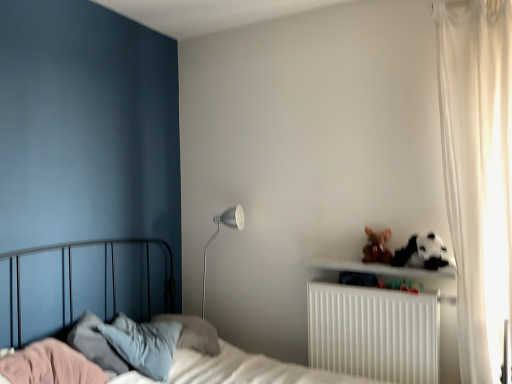
What do you see at coordinates (374, 332) in the screenshot? The width and height of the screenshot is (512, 384). I see `white plastic radiator at lower right` at bounding box center [374, 332].

Measure the distance between point (205, 268) and camera.

Point (205, 268) and camera are 10.15 feet apart.

In order to face white sheer curtain at right, should I rotate leftwards or rightwards?

You should rotate right by 27.325 degrees.

Measure the distance between point (x=379, y=239) and camera.

Point (x=379, y=239) is 7.87 feet away from camera.

Image resolution: width=512 pixels, height=384 pixels. Find the location of `white plastic radiator at lower right`. white plastic radiator at lower right is located at coordinates (374, 332).

Is white sheer curtain at right at the back of metallic bed at left?

metallic bed at left does not have its back to white sheer curtain at right.

Is metallic bed at left bigger than white sheer curtain at right?

Correct, metallic bed at left is larger in size than white sheer curtain at right.

Is metallic bed at left spatially inside white sheer curtain at right, or outside of it?

metallic bed at left is spatially situated outside white sheer curtain at right.

Considering the positions of objects metallic bed at left and white sheer curtain at right in the image provided, who is in front, metallic bed at left or white sheer curtain at right?

metallic bed at left is closer to the camera.

Consider the image. From a real-world perspective, which object stands above the other?

silver metallic floor lamp at center-left, from a real-world perspective.

Who is shorter, silver metallic floor lamp at center-left or metallic bed at left?

Standing shorter between the two is silver metallic floor lamp at center-left.

From the image's perspective, does silver metallic floor lamp at center-left appear lower than metallic bed at left?

No, from the image's perspective, silver metallic floor lamp at center-left is not beneath metallic bed at left.

Considering the points (229, 225) and (200, 349), which point is behind, point (229, 225) or point (200, 349)?

The point (229, 225) is farther from the camera.

Between white sheer curtain at right and silver metallic floor lamp at center-left, which one is positioned behind?

silver metallic floor lamp at center-left is further from the camera.

Does white sheer curtain at right turn towards silver metallic floor lamp at center-left?

No, white sheer curtain at right is not oriented towards silver metallic floor lamp at center-left.

Considering the relative positions of white sheer curtain at right and silver metallic floor lamp at center-left in the image provided, is white sheer curtain at right to the left of silver metallic floor lamp at center-left from the viewer's perspective?

No.

From a real-world perspective, does white sheer curtain at right sit lower than silver metallic floor lamp at center-left?

No, from a real-world perspective, white sheer curtain at right is not under silver metallic floor lamp at center-left.

Based on their positions, is metallic bed at left located to the left or right of silver metallic floor lamp at center-left?

From the image, it's evident that metallic bed at left is to the right of silver metallic floor lamp at center-left.

Is metallic bed at left thinner than silver metallic floor lamp at center-left?

Incorrect, the width of metallic bed at left is not less than that of silver metallic floor lamp at center-left.

From a real-world perspective, between metallic bed at left and silver metallic floor lamp at center-left, who is vertically lower?

In real-world perspective, metallic bed at left is lower.

Does point (226, 220) lie behind point (430, 330)?

Yes, point (226, 220) is farther from viewer.

Identify the location of table lamp behind the white plastic radiator at lower right. This screenshot has height=384, width=512. (217, 234).

Does silver metallic floor lamp at center-left have a smaller size compared to white plastic radiator at lower right?

Indeed, silver metallic floor lamp at center-left has a smaller size compared to white plastic radiator at lower right.

Is white plastic radiator at lower right inside or outside of brown plush toy at upper right?

white plastic radiator at lower right is not inside brown plush toy at upper right, it's outside.

From the image's perspective, is white plastic radiator at lower right under brown plush toy at upper right?

Indeed, from the image's perspective, white plastic radiator at lower right is shown beneath brown plush toy at upper right.

Based on the photo, is white plastic radiator at lower right directly adjacent to brown plush toy at upper right?

No, white plastic radiator at lower right is not beside brown plush toy at upper right.

How distant is white sheer curtain at right from brown plush toy at upper right?

white sheer curtain at right is 24.85 inches from brown plush toy at upper right.

From a real-world perspective, which object stands above the other?

From a 3D spatial view, white sheer curtain at right is above.

Does white sheer curtain at right have a greater height compared to brown plush toy at upper right?

Indeed, white sheer curtain at right has a greater height compared to brown plush toy at upper right.

How different are the orientations of white sheer curtain at right and brown plush toy at upper right in degrees?

The facing directions of white sheer curtain at right and brown plush toy at upper right are 6.64 degrees apart.

Find the location of `bed on the left of white sheer curtain at right`. bed on the left of white sheer curtain at right is located at coordinates (237, 361).

At what (x,y) coordinates should I click in order to perform the action: click on table lamp that appears behind the metallic bed at left. Please return your answer as a coordinate pair (x, y). Looking at the image, I should click on (217, 234).

Considering their positions, is brown plush toy at upper right positioned closer to silver metallic floor lamp at center-left than white plastic radiator at lower right?

brown plush toy at upper right lies closer to silver metallic floor lamp at center-left than the other object.

Looking at the image, which one is located closer to silver metallic floor lamp at center-left, white sheer curtain at right or metallic bed at left?

metallic bed at left.

Which object lies nearer to the anchor point metallic bed at left, brown plush toy at upper right or silver metallic floor lamp at center-left?

The object closer to metallic bed at left is silver metallic floor lamp at center-left.

Based on their spatial positions, is white plastic radiator at lower right or metallic bed at left closer to brown plush toy at upper right?

The object closer to brown plush toy at upper right is white plastic radiator at lower right.

Looking at the image, which one is located closer to white sheer curtain at right, metallic bed at left or brown plush toy at upper right?

brown plush toy at upper right lies closer to white sheer curtain at right than the other object.

When comparing their distances from silver metallic floor lamp at center-left, does white plastic radiator at lower right or metallic bed at left seem closer?

The object closer to silver metallic floor lamp at center-left is metallic bed at left.

Looking at this image, looking at the image, which one is located closer to white plastic radiator at lower right, silver metallic floor lamp at center-left or metallic bed at left?

metallic bed at left is positioned closer to the anchor white plastic radiator at lower right.

When comparing their distances from metallic bed at left, does silver metallic floor lamp at center-left or white sheer curtain at right seem further?

white sheer curtain at right lies further to metallic bed at left than the other object.

Locate an element on the screen. This screenshot has width=512, height=384. curtain between metallic bed at left and silver metallic floor lamp at center-left in the front-back direction is located at coordinates (478, 173).

Image resolution: width=512 pixels, height=384 pixels. I want to click on radiator located between metallic bed at left and brown plush toy at upper right in the depth direction, so click(374, 332).

Locate an element on the screen. The width and height of the screenshot is (512, 384). curtain between metallic bed at left and white plastic radiator at lower right in the front-back direction is located at coordinates (478, 173).

Locate an element on the screen. This screenshot has width=512, height=384. radiator positioned between metallic bed at left and silver metallic floor lamp at center-left from near to far is located at coordinates (374, 332).